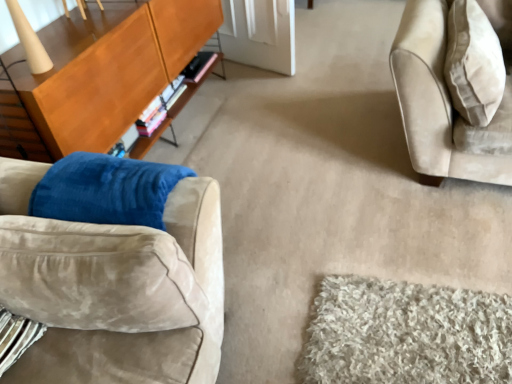
The image size is (512, 384). Identify the location of beige fabric pillow at upper right. (473, 63).

Is wooden cabinet at left taller or shorter than suede couch at left?

In the image, wooden cabinet at left appears to be taller than suede couch at left.

Which is closer to the camera, (88, 20) or (140, 381)?

Point (88, 20) is farther from the camera than point (140, 381).

Considering the sizes of objects wooden cabinet at left and suede couch at left in the image provided, who is bigger, wooden cabinet at left or suede couch at left?

wooden cabinet at left.

Is wooden cabinet at left at the left side of suede couch at left?

Yes, wooden cabinet at left is to the left of suede couch at left.

The width and height of the screenshot is (512, 384). I want to click on throw pillow on the right of the wooden cabinet at left, so click(473, 63).

In the scene shown: Between beige fabric pillow at upper right and wooden cabinet at left, which one has less height?

With less height is beige fabric pillow at upper right.

Would you consider beige fabric pillow at upper right to be distant from wooden cabinet at left?

Yes, beige fabric pillow at upper right and wooden cabinet at left are located far from each other.

Is beige fabric pillow at upper right positioned beyond the bounds of wooden cabinet at left?

Indeed, beige fabric pillow at upper right is completely outside wooden cabinet at left.

Considering the relative sizes of wooden cabinet at left and beige fabric pillow at upper right in the image provided, is wooden cabinet at left bigger than beige fabric pillow at upper right?

Yes.

Does wooden cabinet at left have a greater width compared to beige fabric pillow at upper right?

No, wooden cabinet at left is not wider than beige fabric pillow at upper right.

Does point (146, 3) appear closer or farther from the camera than point (468, 72)?

Clearly, point (146, 3) is more distant from the camera than point (468, 72).

Based on the photo, does suede couch at left lie behind beige fabric pillow at upper right?

No, suede couch at left is closer to the viewer.

Is suede couch at left situated inside beige fabric pillow at upper right or outside?

suede couch at left is located beyond the bounds of beige fabric pillow at upper right.

Considering the sizes of suede couch at left and beige fabric pillow at upper right in the image, is suede couch at left wider or thinner than beige fabric pillow at upper right?

suede couch at left is thinner than beige fabric pillow at upper right.

Is point (196, 271) more distant than point (451, 26)?

No.

Can you confirm if beige fabric pillow at upper right is taller than suede couch at left?

Indeed, beige fabric pillow at upper right has a greater height compared to suede couch at left.

In the scene shown: From the image's perspective, does beige fabric pillow at upper right appear higher than suede couch at left?

Correct, beige fabric pillow at upper right appears higher than suede couch at left in the image.

Is beige fabric pillow at upper right in front of or behind suede couch at left in the image?

Clearly, beige fabric pillow at upper right is behind suede couch at left.

Is suede couch at left placed right next to wooden cabinet at left?

No, suede couch at left is not making contact with wooden cabinet at left.

From a real-world perspective, between suede couch at left and wooden cabinet at left, who is vertically higher?

→ In real-world perspective, suede couch at left is above.

How many degrees apart are the facing directions of suede couch at left and wooden cabinet at left?

The angular difference between suede couch at left and wooden cabinet at left is 5.74 degrees.

Considering the sizes of objects suede couch at left and wooden cabinet at left in the image provided, who is bigger, suede couch at left or wooden cabinet at left?

Bigger between the two is wooden cabinet at left.

The height and width of the screenshot is (384, 512). I want to click on studio couch in front of the wooden cabinet at left, so click(114, 288).

Image resolution: width=512 pixels, height=384 pixels. What are the coordinates of `throw pillow on the right side of wooden cabinet at left` in the screenshot? It's located at (473, 63).

From the image, which object appears to be farther from wooden cabinet at left, beige fabric pillow at upper right or suede couch at left?

beige fabric pillow at upper right lies further to wooden cabinet at left than the other object.

Considering their positions, is suede couch at left positioned further to wooden cabinet at left than beige fabric pillow at upper right?

beige fabric pillow at upper right.

From the image, which object appears to be farther from beige fabric pillow at upper right, wooden cabinet at left or suede couch at left?

wooden cabinet at left is positioned further to the anchor beige fabric pillow at upper right.

Estimate the real-world distances between objects in this image. Which object is further from beige fabric pillow at upper right, suede couch at left or wooden cabinet at left?

Answer: Based on the image, wooden cabinet at left appears to be further to beige fabric pillow at upper right.

Looking at the image, which one is located closer to suede couch at left, beige fabric pillow at upper right or wooden cabinet at left?

wooden cabinet at left lies closer to suede couch at left than the other object.

Based on their spatial positions, is wooden cabinet at left or beige fabric pillow at upper right further from suede couch at left?

beige fabric pillow at upper right lies further to suede couch at left than the other object.

Find the location of `studio couch between wooden cabinet at left and beige fabric pillow at upper right from left to right`. studio couch between wooden cabinet at left and beige fabric pillow at upper right from left to right is located at coordinates (114, 288).